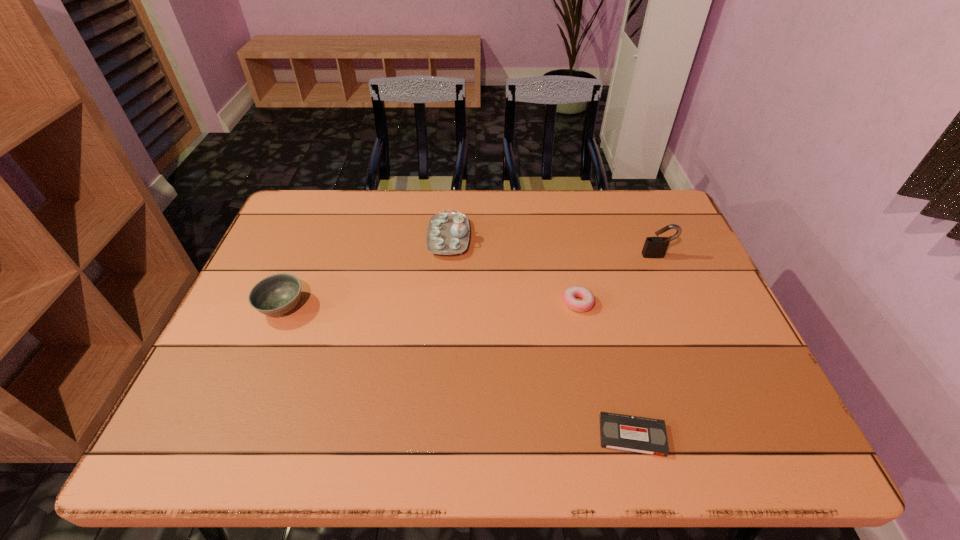
The image size is (960, 540). I want to click on the rightmost object, so click(x=654, y=247).

This screenshot has height=540, width=960. Identify the location of padlock. (654, 247).

Locate an element on the screen. The width and height of the screenshot is (960, 540). the fourth object from right to left is located at coordinates (448, 233).

What are the coordinates of `the second tallest object` in the screenshot? It's located at (448, 233).

Find the location of `bowl`. bowl is located at coordinates (277, 294).

This screenshot has height=540, width=960. I want to click on the leftmost object, so click(277, 294).

I want to click on doughnut, so click(x=569, y=296).

Locate an element on the screen. videotape is located at coordinates (643, 435).

At what (x,y) coordinates should I click in order to perform the action: click on the nearest object. Please return your answer as a coordinate pair (x, y). Looking at the image, I should click on (643, 435).

At what (x,y) coordinates should I click in order to perform the action: click on vacant space located with the keyhole on the front of the rightmost object. Please return your answer as a coordinate pair (x, y). This screenshot has height=540, width=960. Looking at the image, I should click on 697,349.